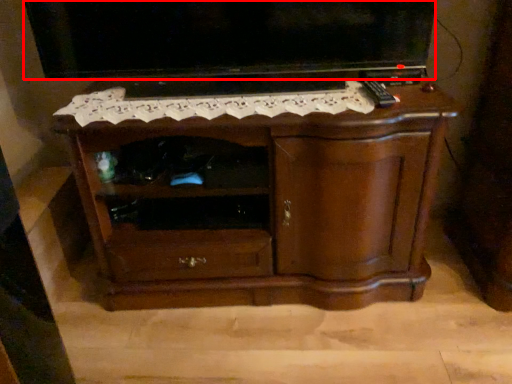
Question: Where is television (annotated by the red box) located in relation to chest of drawers in the image?

Choices:
 (A) right
 (B) left

Answer: (B)